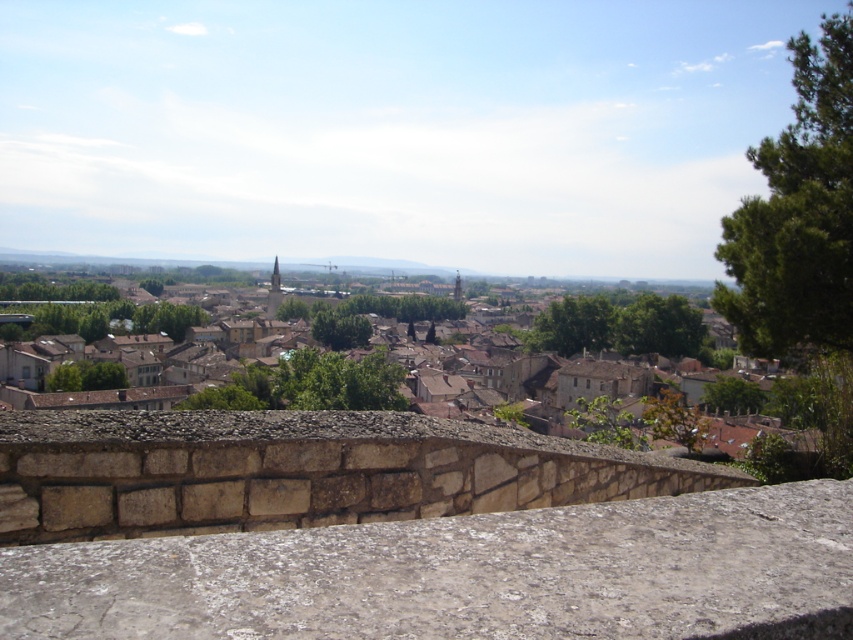
Question: Is the position of stone ledge at center less distant than that of brown stone town at center?

Choices:
 (A) yes
 (B) no

Answer: (A)

Question: Which object is farther from the camera taking this photo?

Choices:
 (A) stone ledge at center
 (B) brown stone town at center

Answer: (B)

Question: Is stone ledge at center further to camera compared to brown stone town at center?

Choices:
 (A) yes
 (B) no

Answer: (B)

Question: Is the position of stone ledge at center less distant than that of brown stone town at center?

Choices:
 (A) yes
 (B) no

Answer: (A)

Question: Which point is closer to the camera?

Choices:
 (A) stone ledge at center
 (B) brown stone town at center
 (C) rough stone ledge at center

Answer: (C)

Question: Considering the real-world distances, which object is farthest from the rough stone ledge at center?

Choices:
 (A) stone ledge at center
 (B) brown stone town at center

Answer: (B)